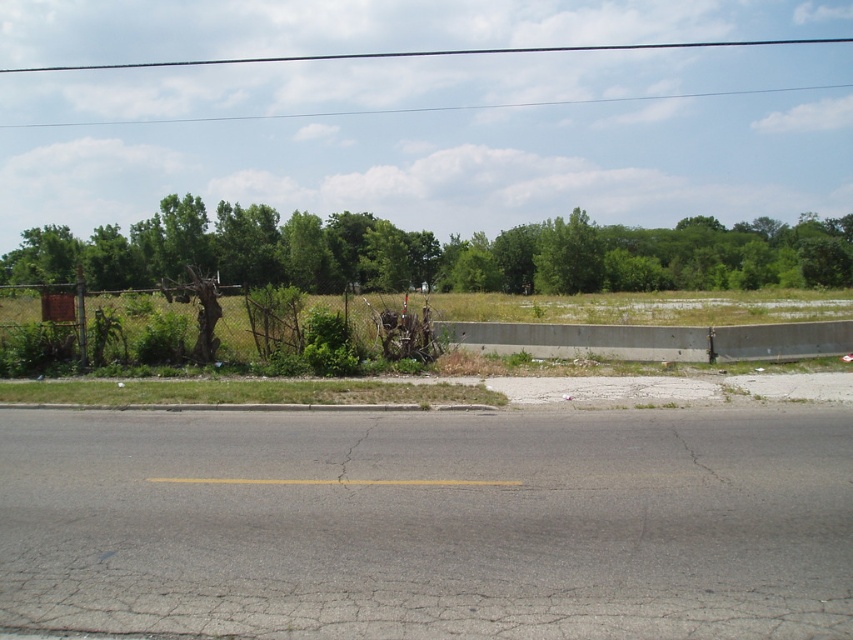
Question: Which of the following is the farthest from the observer?

Choices:
 (A) green leafy tree at upper center
 (B) rusty metal fence at left

Answer: (B)

Question: Where is green leafy tree at upper center located in relation to rusty metal fence at left in the image?

Choices:
 (A) left
 (B) right

Answer: (A)

Question: Can you confirm if green leafy tree at upper center is thinner than rusty metal fence at left?

Choices:
 (A) no
 (B) yes

Answer: (A)

Question: Which point appears farthest from the camera in this image?

Choices:
 (A) (151, 243)
 (B) (196, 285)

Answer: (A)

Question: Is green leafy tree at upper center smaller than rusty metal fence at left?

Choices:
 (A) yes
 (B) no

Answer: (B)